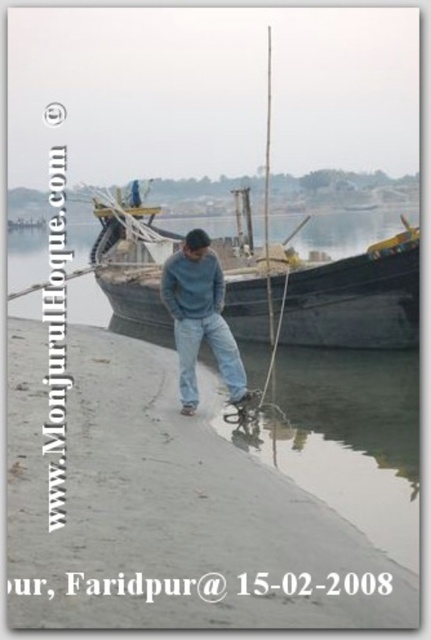
Question: Among these objects, which one is nearest to the camera?

Choices:
 (A) matte blue jeans at center
 (B) denim jeans at center
 (C) wooden boat at center
 (D) smooth concrete shore at center

Answer: (D)

Question: Can you confirm if wooden boat at center is positioned below matte blue jeans at center?

Choices:
 (A) yes
 (B) no

Answer: (B)

Question: Which point is closer to the camera taking this photo?

Choices:
 (A) (331, 544)
 (B) (181, 339)

Answer: (A)

Question: Which point is farther to the camera?

Choices:
 (A) (184, 294)
 (B) (183, 365)
 (C) (24, 560)

Answer: (B)

Question: Does matte blue jeans at center have a greater width compared to denim jeans at center?

Choices:
 (A) yes
 (B) no

Answer: (B)

Question: Can you confirm if smooth concrete shore at center is bigger than denim jeans at center?

Choices:
 (A) yes
 (B) no

Answer: (B)